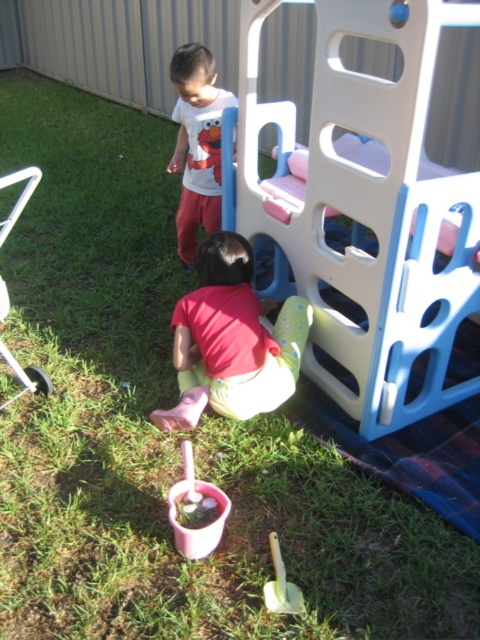
Is pink rubber boots at lower center to the left of pink plastic cup at lower center from the viewer's perspective?

No, pink rubber boots at lower center is not to the left of pink plastic cup at lower center.

From the picture: Can you confirm if pink rubber boots at lower center is smaller than pink plastic cup at lower center?

No, pink rubber boots at lower center is not smaller than pink plastic cup at lower center.

Is point (151, 413) positioned in front of point (175, 496)?

No, it is behind (175, 496).

Where is `pink rubber boots at lower center`? pink rubber boots at lower center is located at coordinates (231, 340).

Can you confirm if white matte shirt at upper center is positioned to the right of yellow plastic shovel at lower center?

In fact, white matte shirt at upper center is to the left of yellow plastic shovel at lower center.

Does point (175, 148) lie behind point (284, 596)?

That is True.

Locate an element on the screen. white matte shirt at upper center is located at coordinates (196, 144).

Which is more to the right, white matte shirt at upper center or pink plastic cup at lower center?

pink plastic cup at lower center

In order to click on white matte shirt at upper center in this screenshot , I will do `click(196, 144)`.